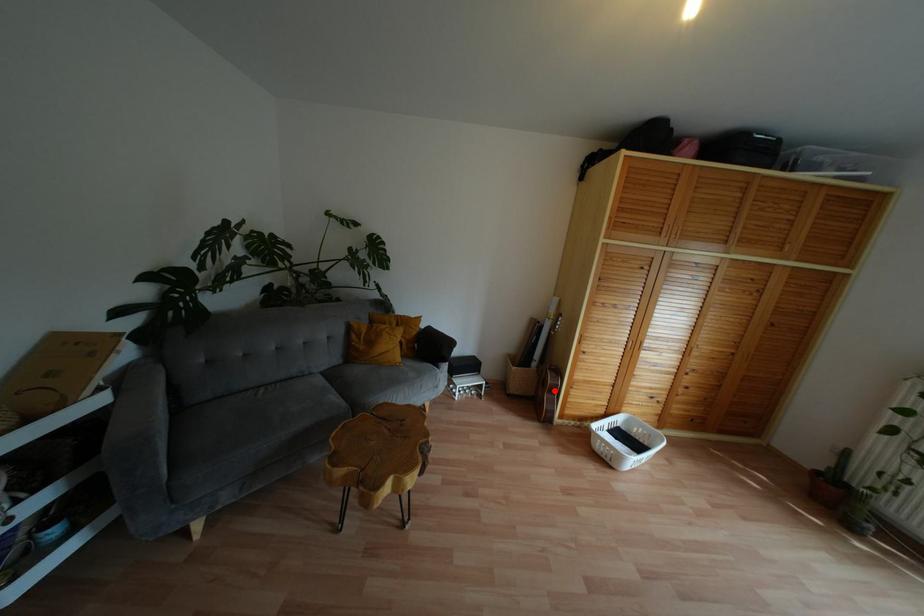
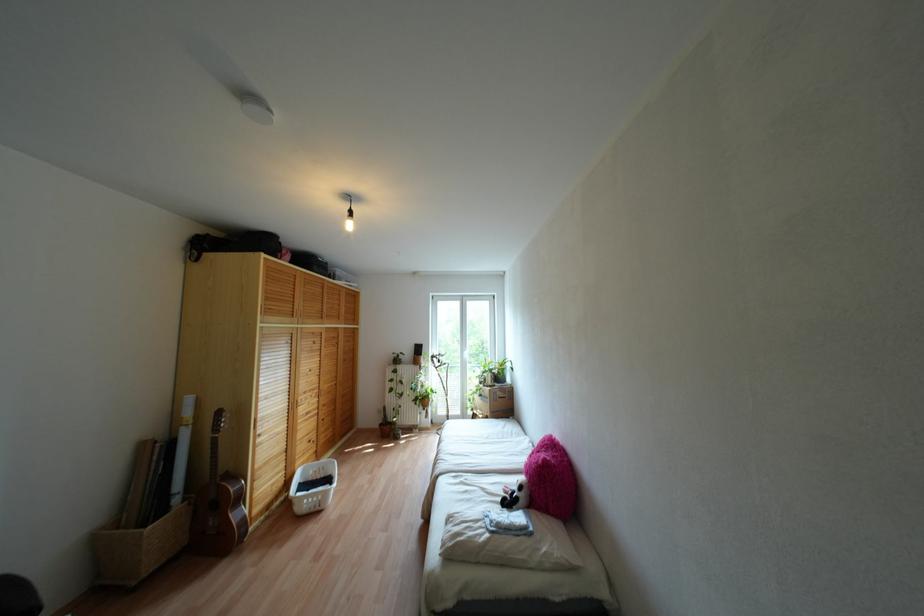
The point at the highlighted location is marked in the first image. Where is the corresponding point in the second image?

(238, 498)